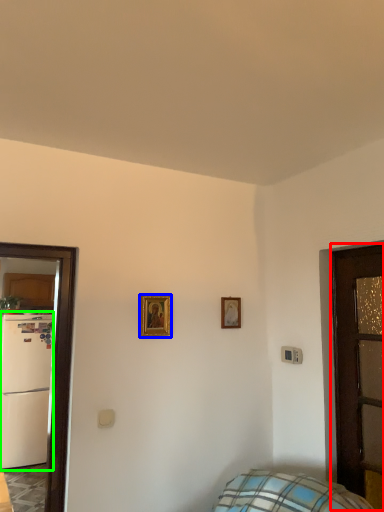
Question: Estimate the real-world distances between objects in this image. Which object is farther from door (highlighted by a red box), picture frame (highlighted by a blue box) or fridge (highlighted by a green box)?

Choices:
 (A) picture frame
 (B) fridge

Answer: (B)